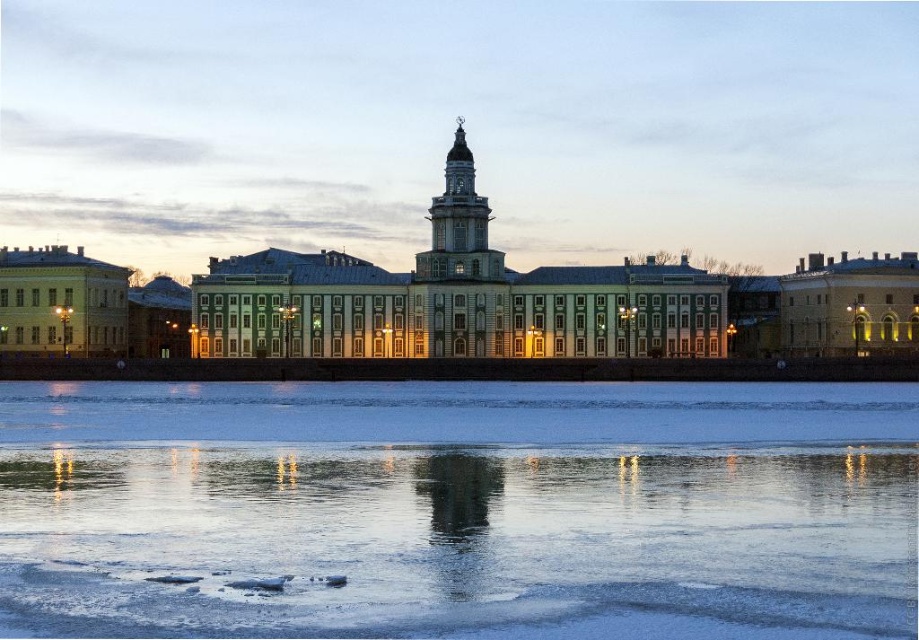
Between white stone building at center and light gray stone tower at center, which one appears on the right side from the viewer's perspective?

light gray stone tower at center

Image resolution: width=919 pixels, height=640 pixels. In order to click on white stone building at center in this screenshot , I will do `click(452, 298)`.

Between point (486, 326) and point (462, 168), which one is positioned in front?

Positioned in front is point (486, 326).

I want to click on white stone building at center, so click(x=452, y=298).

Who is more forward, (399, 451) or (427, 252)?

Point (399, 451) is in front.

Measure the distance between translucent ice at lower center and camera.

The distance of translucent ice at lower center from camera is 80.04 meters.

The width and height of the screenshot is (919, 640). In order to click on translucent ice at lower center in this screenshot , I will do `click(460, 502)`.

Does translucent ice at lower center appear under white stone building at center?

Correct, translucent ice at lower center is located below white stone building at center.

Can you confirm if translucent ice at lower center is positioned to the right of white stone building at center?

Yes, translucent ice at lower center is to the right of white stone building at center.

The image size is (919, 640). What do you see at coordinates (460, 502) in the screenshot?
I see `translucent ice at lower center` at bounding box center [460, 502].

This screenshot has width=919, height=640. Identify the location of translucent ice at lower center. (460, 502).